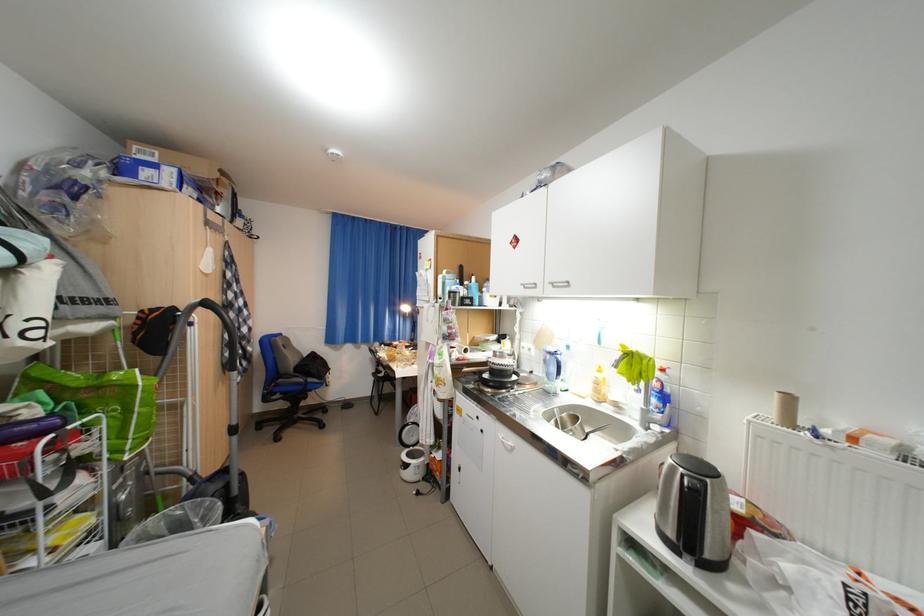
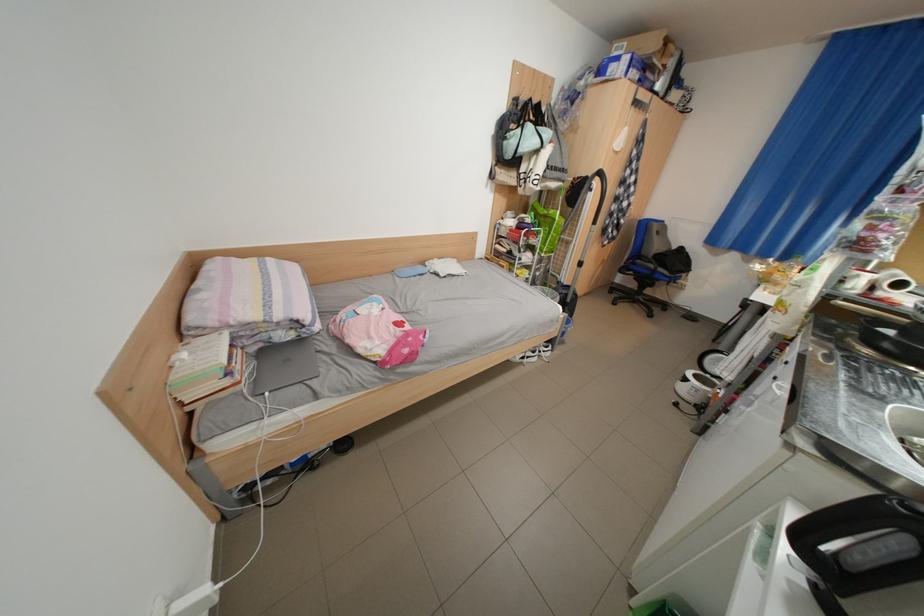
The point at (325, 368) is marked in the first image. Where is the corresponding point in the second image?

(687, 264)